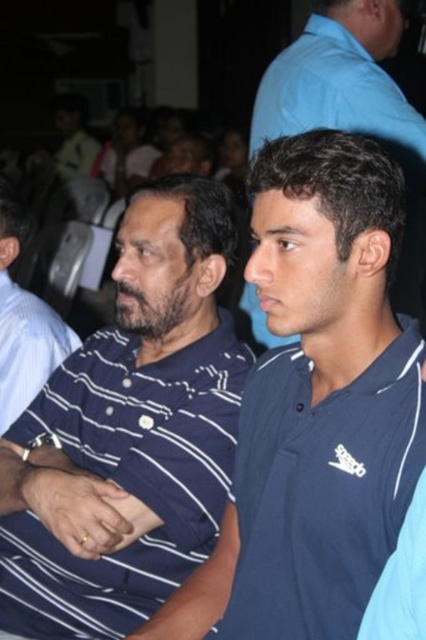
Question: Which point is closer to the camera taking this photo?

Choices:
 (A) (348, 6)
 (B) (293, 508)

Answer: (B)

Question: Is dark blue striped polo shirt at center positioned in front of blue smooth shirt at center?

Choices:
 (A) no
 (B) yes

Answer: (B)

Question: Based on their relative distances, which object is nearer to the blue smooth shirt at center?

Choices:
 (A) navy blue/soft cotton polo shirt at center
 (B) dark blue striped polo shirt at center

Answer: (B)

Question: Can you confirm if dark blue striped polo shirt at center is bigger than blue smooth shirt at center?

Choices:
 (A) no
 (B) yes

Answer: (A)

Question: Among these objects, which one is nearest to the camera?

Choices:
 (A) blue smooth shirt at center
 (B) dark blue striped polo shirt at center

Answer: (B)

Question: Does dark blue striped polo shirt at center appear under blue smooth shirt at center?

Choices:
 (A) no
 (B) yes

Answer: (B)